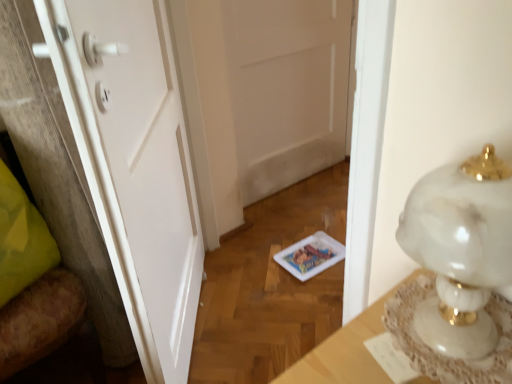
Question: Considering the positions of point (325, 77) and point (470, 359), is point (325, 77) closer or farther from the camera than point (470, 359)?

Choices:
 (A) farther
 (B) closer

Answer: (A)

Question: In terms of height, does white matte door at center, the second door when ordered from front to back, look taller or shorter compared to white marble lamp at right?

Choices:
 (A) short
 (B) tall

Answer: (B)

Question: Based on their relative distances, which object is farther from the white marble lamp at right?

Choices:
 (A) wooden chair at left
 (B) white marble table at right
 (C) white matte door at center, acting as the first door starting from the back
 (D) white matte door at center, the second door from the right

Answer: (C)

Question: Estimate the real-world distances between objects in this image. Which object is farther from the white marble table at right?

Choices:
 (A) white matte door at center, the second door from the right
 (B) wooden chair at left
 (C) white matte door at center, the first door when ordered from right to left
 (D) white marble lamp at right

Answer: (C)